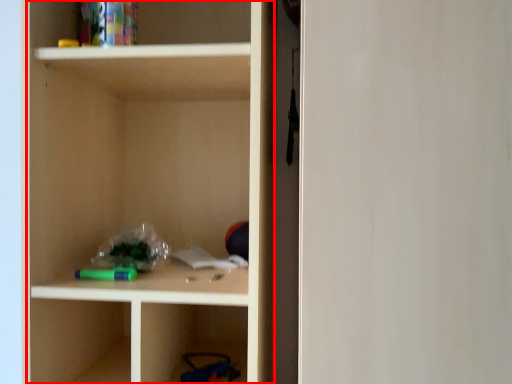
Question: Where is cabinetry (annotated by the red box) located in relation to glass door in the image?

Choices:
 (A) left
 (B) right

Answer: (A)